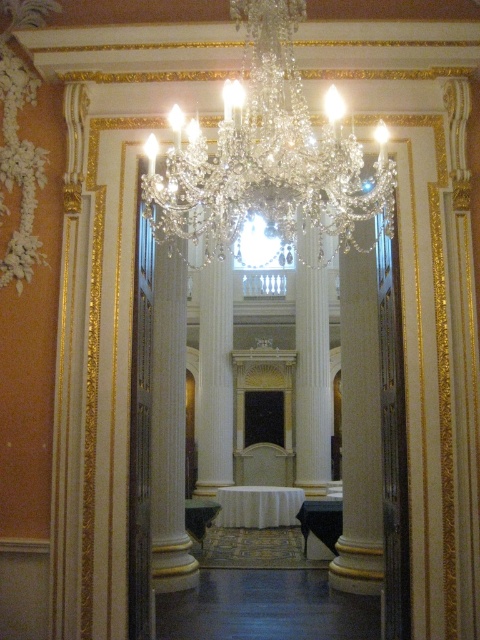
Question: Can you confirm if crystal clear chandelier at center is bigger than white marble pillar at center?

Choices:
 (A) no
 (B) yes

Answer: (B)

Question: Which point is closer to the camera?

Choices:
 (A) (228, 99)
 (B) (324, 472)

Answer: (A)

Question: Is crystal clear chandelier at center positioned before white marble pillar at center?

Choices:
 (A) no
 (B) yes

Answer: (B)

Question: Which point is closer to the camera?

Choices:
 (A) white marble pillar at center
 (B) crystal clear chandelier at center

Answer: (B)

Question: Which object is farther from the camera taking this photo?

Choices:
 (A) white marble pillar at center
 (B) crystal clear chandelier at center

Answer: (A)

Question: Can you confirm if crystal clear chandelier at center is thinner than white marble pillar at center?

Choices:
 (A) no
 (B) yes

Answer: (A)